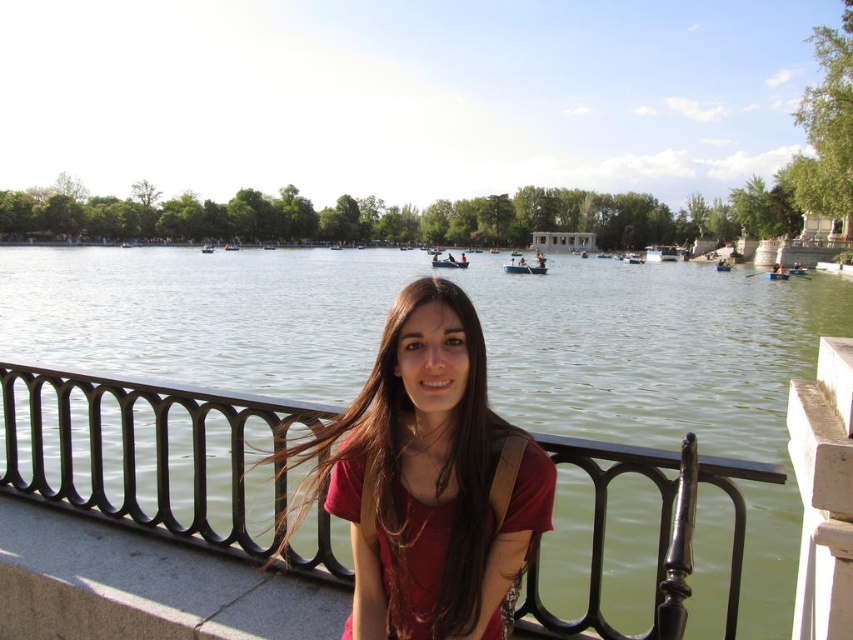
Who is more forward, (489, 529) or (451, 264)?

Point (489, 529) is more forward.

Does matte red dress at center have a larger size compared to wooden boat at center?

Incorrect, matte red dress at center is not larger than wooden boat at center.

This screenshot has width=853, height=640. In order to click on matte red dress at center in this screenshot , I will do `click(422, 557)`.

Who is lower down, matte red shirt at center or matte red dress at center?

matte red dress at center

Can you confirm if matte red shirt at center is thinner than matte red dress at center?

No.

Who is more distant from viewer, [488,416] or [532,516]?

The point [488,416] is behind.

The height and width of the screenshot is (640, 853). I want to click on matte red shirt at center, so click(428, 480).

From the picture: Does wooden rowboat at center appear on the left side of wooden boat at center?

Incorrect, wooden rowboat at center is not on the left side of wooden boat at center.

This screenshot has height=640, width=853. Describe the element at coordinates (526, 266) in the screenshot. I see `wooden rowboat at center` at that location.

Who is more distant from viewer, (509, 268) or (453, 262)?

The point (453, 262) is more distant.

At what (x,y) coordinates should I click in order to perform the action: click on wooden rowboat at center. Please return your answer as a coordinate pair (x, y). The image size is (853, 640). Looking at the image, I should click on (526, 266).